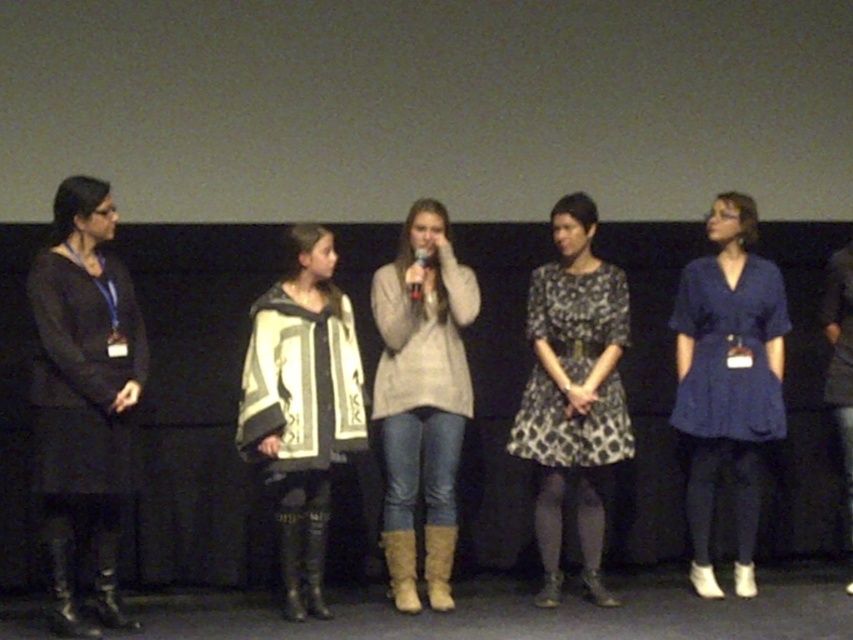
Question: Which of the following is the closest to the observer?

Choices:
 (A) (119, 417)
 (B) (328, 428)

Answer: (A)

Question: Which is farther from the tan suede boot at center?

Choices:
 (A) blue satin dress at right
 (B) white and black patterned poncho at center

Answer: (A)

Question: Is matte black dress at left closer to the viewer compared to blue satin dress at right?

Choices:
 (A) no
 (B) yes

Answer: (B)

Question: Can you confirm if printed fabric dress at center is thinner than blue satin dress at right?

Choices:
 (A) yes
 (B) no

Answer: (B)

Question: Which point is farther from the camera taking this photo?

Choices:
 (A) pos(708,506)
 (B) pos(323,484)
 (C) pos(453,532)
 (D) pos(428,262)

Answer: (A)

Question: Can you confirm if matte black dress at left is positioned to the left of light beige sweater at center?

Choices:
 (A) no
 (B) yes

Answer: (B)